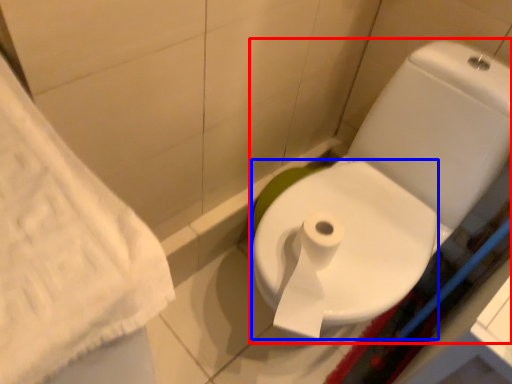
Question: Which point is closer to the camera, toilet (highlighted by a red box) or bidet (highlighted by a blue box)?

Choices:
 (A) toilet
 (B) bidet

Answer: (A)